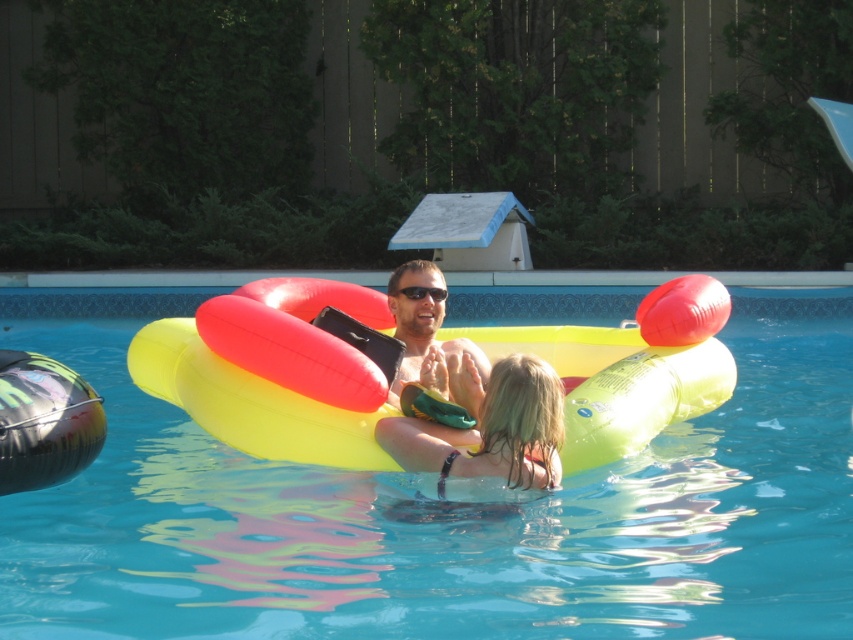
Consider the image. Who is more forward, (405,380) or (426,291)?

Point (405,380) is in front.

Which is behind, point (396, 308) or point (438, 292)?

The point (396, 308) is more distant.

Where is `matte yellow float at center`? matte yellow float at center is located at coordinates (432, 339).

Who is lower down, yellow rubber ring at center or shiny blonde hair at center?

shiny blonde hair at center is below.

Is point (186, 314) closer to viewer compared to point (482, 410)?

No, it is not.

Is point (531, 300) less distant than point (561, 416)?

No, it is behind (561, 416).

You are a GUI agent. You are given a task and a screenshot of the screen. Output one action in this format:
    pyautogui.click(x=<x>, y=<y>)
    Task: Click on the yellow rubber ring at center
    Image resolution: width=853 pixels, height=640 pixels.
    Given the screenshot: What is the action you would take?
    pyautogui.click(x=433, y=525)

Can you confirm if shiny blonde hair at center is wider than black plastic sunglasses at center?

Indeed, shiny blonde hair at center has a greater width compared to black plastic sunglasses at center.

Does shiny blonde hair at center appear under black plastic sunglasses at center?

Indeed, shiny blonde hair at center is positioned under black plastic sunglasses at center.

Is point (560, 385) behind point (431, 292)?

No, (560, 385) is in front of (431, 292).

You are a GUI agent. You are given a task and a screenshot of the screen. Output one action in this format:
    pyautogui.click(x=<x>, y=<y>)
    Task: Click on the shiny blonde hair at center
    This screenshot has width=853, height=640.
    Given the screenshot: What is the action you would take?
    pyautogui.click(x=491, y=432)